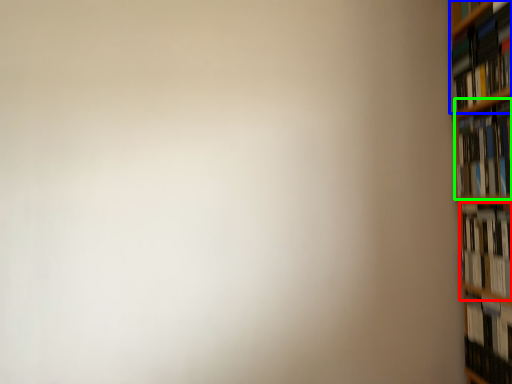
Question: Which object is the farthest from book (highlighted by a red box)? Choose among these: book (highlighted by a blue box) or book (highlighted by a green box).

Choices:
 (A) book
 (B) book

Answer: (A)